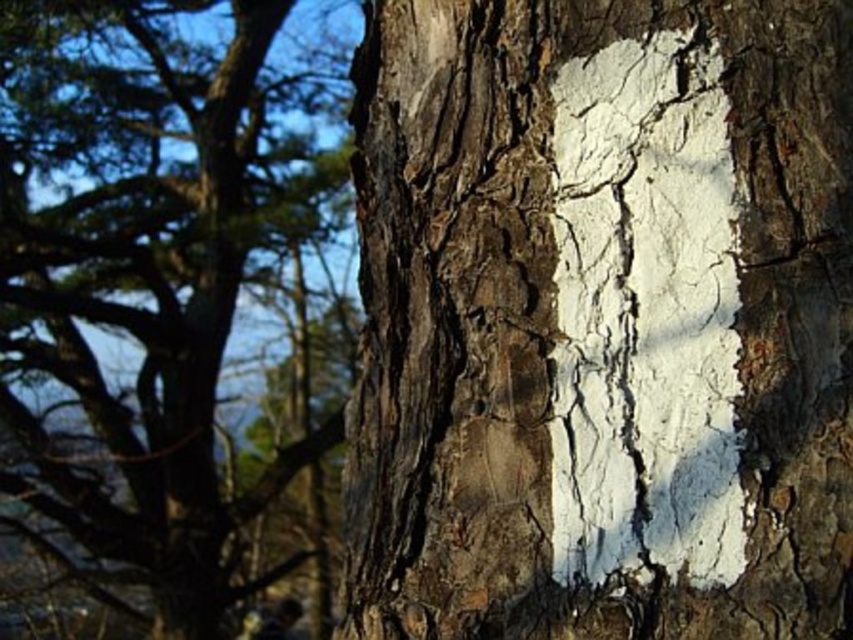
Does white cracked bark at center have a greater width compared to cracked bark tree trunk at center?

In fact, white cracked bark at center might be narrower than cracked bark tree trunk at center.

Does white cracked bark at center have a lesser height compared to cracked bark tree trunk at center?

Yes, white cracked bark at center is shorter than cracked bark tree trunk at center.

The height and width of the screenshot is (640, 853). Find the location of `white cracked bark at center`. white cracked bark at center is located at coordinates (602, 321).